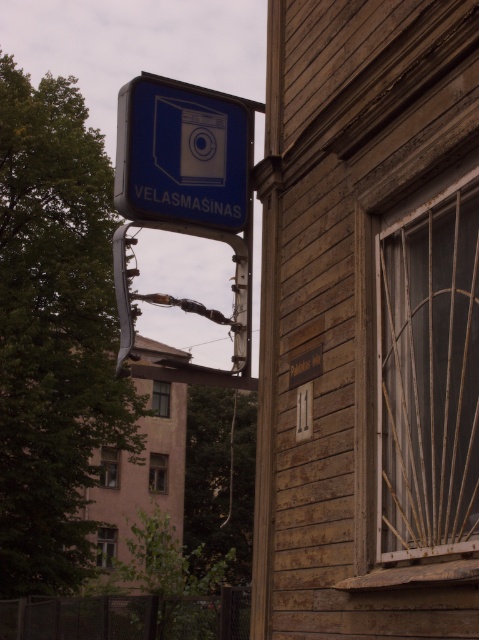
Looking at this image, is clear glass window at lower left positioned at the back of clear glass window at center?

No, it is not.

Does point (114, 545) come farther from viewer compared to point (158, 410)?

That is False.

The width and height of the screenshot is (479, 640). I want to click on clear glass window at lower left, so coord(105,547).

Who is taller, blue plastic sign at upper left or transparent glass window at lower left?

With more height is transparent glass window at lower left.

Can you confirm if blue plastic sign at upper left is positioned to the right of transparent glass window at lower left?

Correct, you'll find blue plastic sign at upper left to the right of transparent glass window at lower left.

At what (x,y) coordinates should I click in order to perform the action: click on blue plastic sign at upper left. Please return your answer as a coordinate pair (x, y). This screenshot has height=640, width=479. Looking at the image, I should click on (182, 154).

This screenshot has width=479, height=640. Describe the element at coordinates (105, 547) in the screenshot. I see `clear glass window at lower left` at that location.

Who is positioned more to the right, clear glass window at lower left or transparent glass window at lower left?

transparent glass window at lower left is more to the right.

Locate an element on the screen. The height and width of the screenshot is (640, 479). clear glass window at lower left is located at coordinates (105, 547).